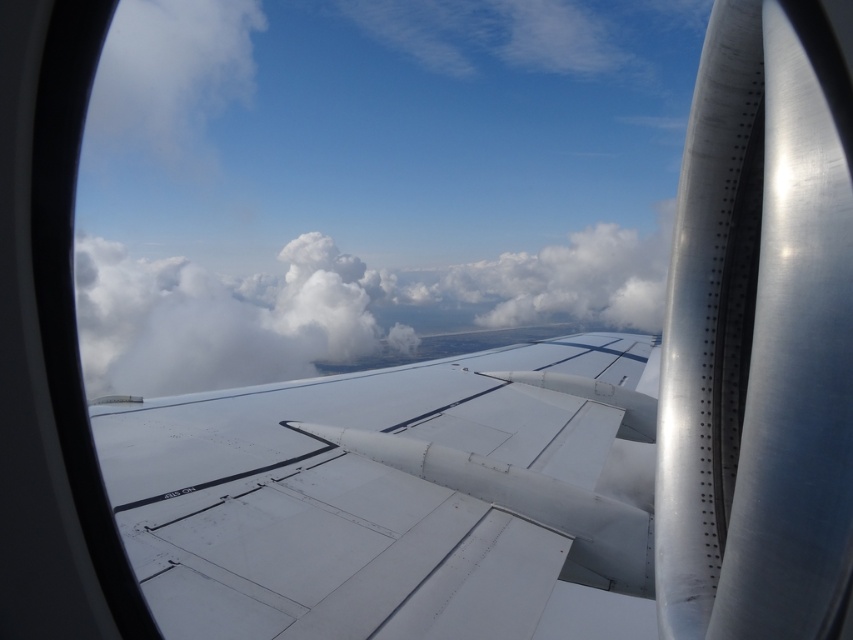
Question: Is white matte wing at center positioned in front of white fluffy cloud at center?

Choices:
 (A) yes
 (B) no

Answer: (B)

Question: Can you confirm if white matte wing at center is positioned to the left of white fluffy cloud at center?

Choices:
 (A) yes
 (B) no

Answer: (B)

Question: Can you confirm if white matte wing at center is bigger than white fluffy cloud at center?

Choices:
 (A) yes
 (B) no

Answer: (B)

Question: Which point appears closest to the camera in this image?

Choices:
 (A) (477, 280)
 (B) (368, 536)

Answer: (B)